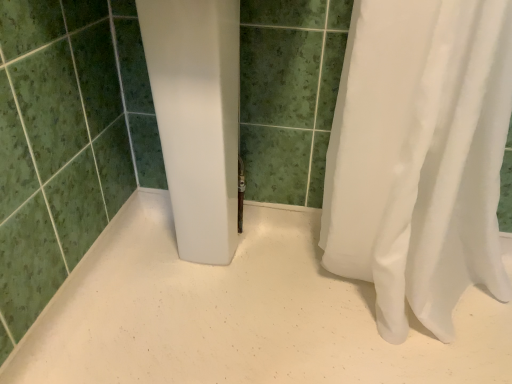
At what (x,y) coordinates should I click in order to perform the action: click on green matte tile at center. Please return your answer as a coordinate pair (x, y). This screenshot has height=384, width=512. Looking at the image, I should click on (66, 141).

Measure the distance between green matte tile at center and camera.

27.74 inches.

Image resolution: width=512 pixels, height=384 pixels. Describe the element at coordinates (66, 141) in the screenshot. I see `green matte tile at center` at that location.

Where is `white matte shower curtain at right`? The image size is (512, 384). white matte shower curtain at right is located at coordinates (239, 315).

What do you see at coordinates (239, 315) in the screenshot?
I see `white matte shower curtain at right` at bounding box center [239, 315].

Locate an element on the screen. Image resolution: width=512 pixels, height=384 pixels. green matte tile at center is located at coordinates (66, 141).

Considering the positions of objects green matte tile at center and white matte shower curtain at right in the image provided, who is more to the left, green matte tile at center or white matte shower curtain at right?

green matte tile at center is more to the left.

Is the position of green matte tile at center less distant than that of white matte shower curtain at right?

Yes, green matte tile at center is in front of white matte shower curtain at right.

Considering the positions of points (47, 38) and (285, 277), is point (47, 38) farther from camera compared to point (285, 277)?

No, it is in front of (285, 277).

From the image's perspective, does green matte tile at center appear lower than white matte shower curtain at right?

No.

From a real-world perspective, is green matte tile at center positioned above or below white matte shower curtain at right?

green matte tile at center is above white matte shower curtain at right.

Which of these two, green matte tile at center or white matte shower curtain at right, is thinner?

With smaller width is green matte tile at center.

Between green matte tile at center and white matte shower curtain at right, which one has less height?

With less height is white matte shower curtain at right.

Considering the sizes of objects green matte tile at center and white matte shower curtain at right in the image provided, who is smaller, green matte tile at center or white matte shower curtain at right?

With smaller size is white matte shower curtain at right.

Is green matte tile at center positioned beyond the bounds of white matte shower curtain at right?

Yes, green matte tile at center is not within white matte shower curtain at right.

Is green matte tile at center beside white matte shower curtain at right?

No, green matte tile at center is not making contact with white matte shower curtain at right.

Could you tell me if green matte tile at center is turned towards white matte shower curtain at right?

No, green matte tile at center is not oriented towards white matte shower curtain at right.

Can you tell me how much green matte tile at center and white matte shower curtain at right differ in facing direction?

The facing directions of green matte tile at center and white matte shower curtain at right are 88.2 degrees apart.

Measure the distance between green matte tile at center and white matte shower curtain at right.

green matte tile at center and white matte shower curtain at right are 34.62 centimeters apart from each other.

I want to click on ceramic tile above the white matte shower curtain at right (from a real-world perspective), so click(66, 141).

Which is more to the right, white matte shower curtain at right or green matte tile at center?

white matte shower curtain at right.

Which is behind, white matte shower curtain at right or green matte tile at center?

white matte shower curtain at right is further from the camera.

Does point (169, 234) come behind point (32, 131)?

Yes, point (169, 234) is behind point (32, 131).

From the image's perspective, is white matte shower curtain at right above green matte tile at center?

Actually, white matte shower curtain at right appears below green matte tile at center in the image.

From a real-world perspective, between white matte shower curtain at right and green matte tile at center, who is vertically lower?

white matte shower curtain at right.

Does white matte shower curtain at right have a greater width compared to green matte tile at center?

Indeed, white matte shower curtain at right has a greater width compared to green matte tile at center.

Considering the relative sizes of white matte shower curtain at right and green matte tile at center in the image provided, is white matte shower curtain at right taller than green matte tile at center?

No.

Considering the relative sizes of white matte shower curtain at right and green matte tile at center in the image provided, is white matte shower curtain at right smaller than green matte tile at center?

Correct, white matte shower curtain at right occupies less space than green matte tile at center.

Is green matte tile at center located within white matte shower curtain at right?

No, green matte tile at center is located outside of white matte shower curtain at right.

Is the surface of white matte shower curtain at right in direct contact with green matte tile at center?

white matte shower curtain at right and green matte tile at center are clearly separated.

Is white matte shower curtain at right aimed at green matte tile at center?

Yes, white matte shower curtain at right is oriented towards green matte tile at center.

In the scene shown: What's the angular difference between white matte shower curtain at right and green matte tile at center's facing directions?

The angular difference between white matte shower curtain at right and green matte tile at center is 88.2 degrees.

You are a GUI agent. You are given a task and a screenshot of the screen. Output one action in this format:
    pyautogui.click(x=<x>, y=<y>)
    Task: Click on the plain located behind the green matte tile at center
    
    Given the screenshot: What is the action you would take?
    [x=239, y=315]

This screenshot has height=384, width=512. In order to click on plain that is behind the green matte tile at center in this screenshot , I will do `click(239, 315)`.

You are a GUI agent. You are given a task and a screenshot of the screen. Output one action in this format:
    pyautogui.click(x=<x>, y=<y>)
    Task: Click on the ceramic tile positioned vertically above the white matte shower curtain at right (from a real-world perspective)
    Image resolution: width=512 pixels, height=384 pixels.
    Given the screenshot: What is the action you would take?
    pyautogui.click(x=66, y=141)